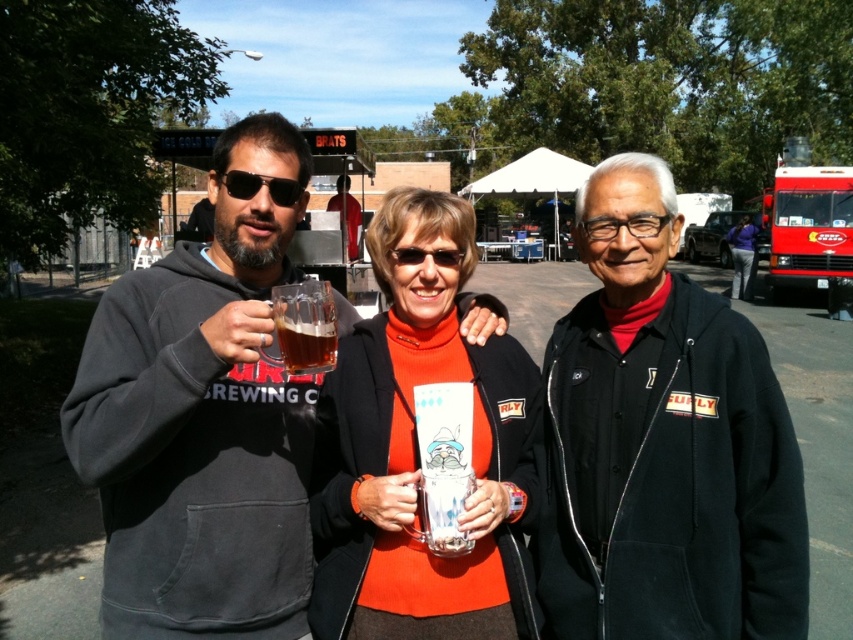
Is matte ceramic mug at center bigger than black plastic goggles at center?

Yes, matte ceramic mug at center is bigger than black plastic goggles at center.

Between matte ceramic mug at center and black plastic goggles at center, which one is positioned lower?

matte ceramic mug at center is lower down.

This screenshot has height=640, width=853. What do you see at coordinates (416, 451) in the screenshot? I see `matte ceramic mug at center` at bounding box center [416, 451].

Find the location of a particular element. This screenshot has width=853, height=640. matte ceramic mug at center is located at coordinates (416, 451).

Describe the element at coordinates (202, 420) in the screenshot. I see `matte black hoodie at left` at that location.

Can you confirm if matte black hoodie at left is positioned above matte ceramic mug at center?

Indeed, matte black hoodie at left is positioned over matte ceramic mug at center.

Which is behind, point (132, 321) or point (393, 576)?

The point (393, 576) is more distant.

Identify the location of matte black hoodie at left. (202, 420).

Who is higher up, black matte jacket at center or matte black hoodie at left?

Positioned higher is matte black hoodie at left.

Which is in front, point (614, 426) or point (160, 284)?

Point (614, 426) is in front.

Image resolution: width=853 pixels, height=640 pixels. Find the location of `black matte jacket at center`. black matte jacket at center is located at coordinates (663, 444).